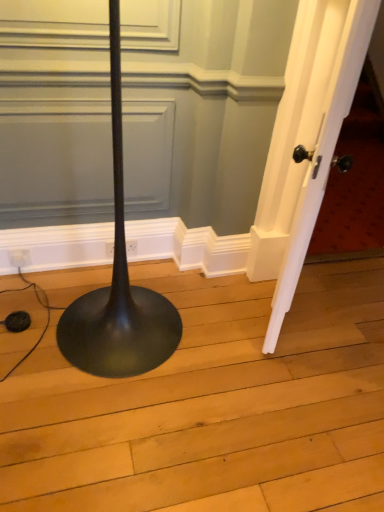
Identify the location of vacant point to the right of white wooden door at right. (337, 316).